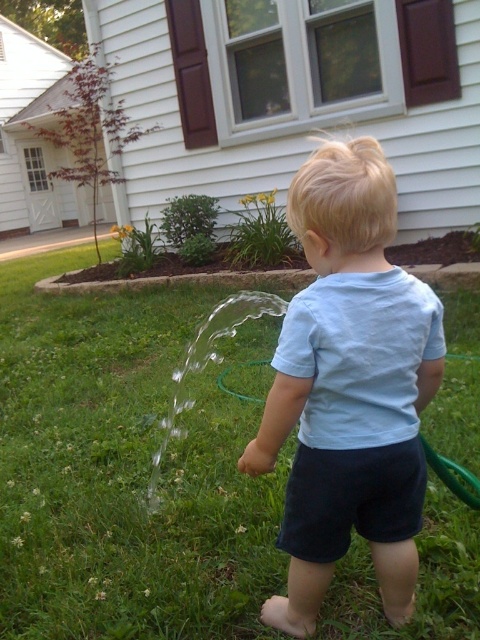
Between green grass at center and green rubber hose at lower center, which one appears on the left side from the viewer's perspective?

Positioned to the left is green grass at center.

Who is more forward, (326,602) or (434,451)?

Point (326,602)

Locate an element on the screen. green grass at center is located at coordinates (129, 467).

Locate an element on the screen. Image resolution: width=480 pixels, height=640 pixels. green grass at center is located at coordinates (129, 467).

Does point (43, 468) lie behind point (240, 468)?

Yes.

The image size is (480, 640). Identify the location of green grass at center. (129, 467).

Is light blue cotton shirt at center thinner than green rubber hose at lower center?

In fact, light blue cotton shirt at center might be wider than green rubber hose at lower center.

Which is behind, point (422, 291) or point (220, 380)?

Positioned behind is point (220, 380).

You are a GUI agent. You are given a task and a screenshot of the screen. Output one action in this format:
    pyautogui.click(x=<x>, y=<y>)
    Task: Click on the light blue cotton shirt at center
    This screenshot has width=480, height=640.
    Given the screenshot: What is the action you would take?
    point(348,317)